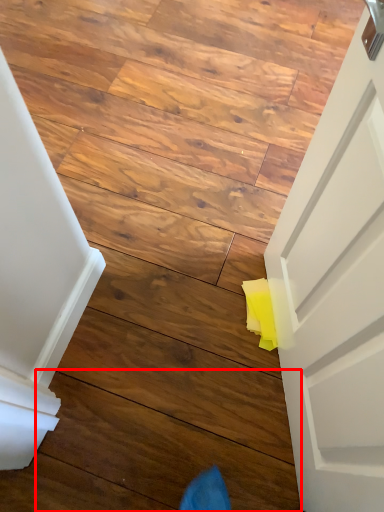
Question: Considering the relative positions of plank (annotated by the red box) and stairwell in the image provided, where is plank (annotated by the red box) located with respect to the staircase?

Choices:
 (A) right
 (B) left

Answer: (A)